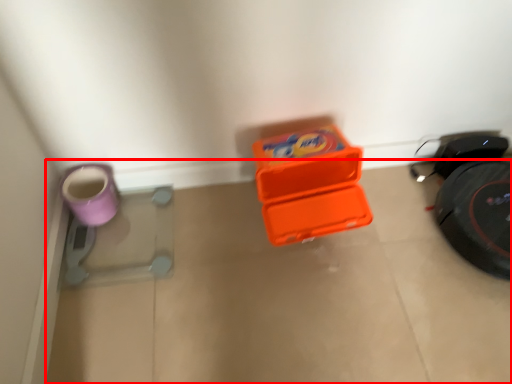
Question: Observing the image, what is the correct spatial positioning of concrete (annotated by the red box) in reference to footwear?

Choices:
 (A) right
 (B) left

Answer: (A)